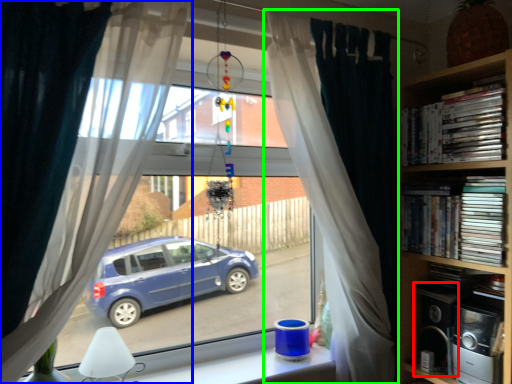
Question: Considering the real-world distances, which object is farthest from appliance (highlighted by a red box)? curtain (highlighted by a blue box) or curtain (highlighted by a green box)?

Choices:
 (A) curtain
 (B) curtain

Answer: (A)